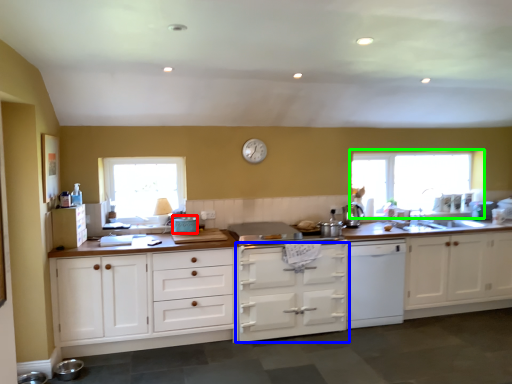
Question: Which is farther away from appliance (highlighted by a red box)? cabinetry (highlighted by a blue box) or window (highlighted by a green box)?

Choices:
 (A) cabinetry
 (B) window

Answer: (B)